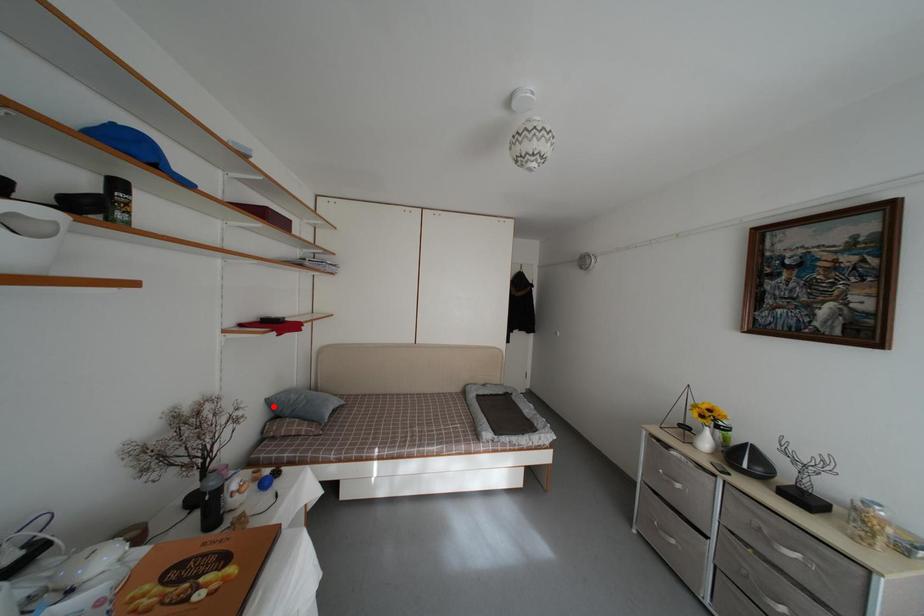
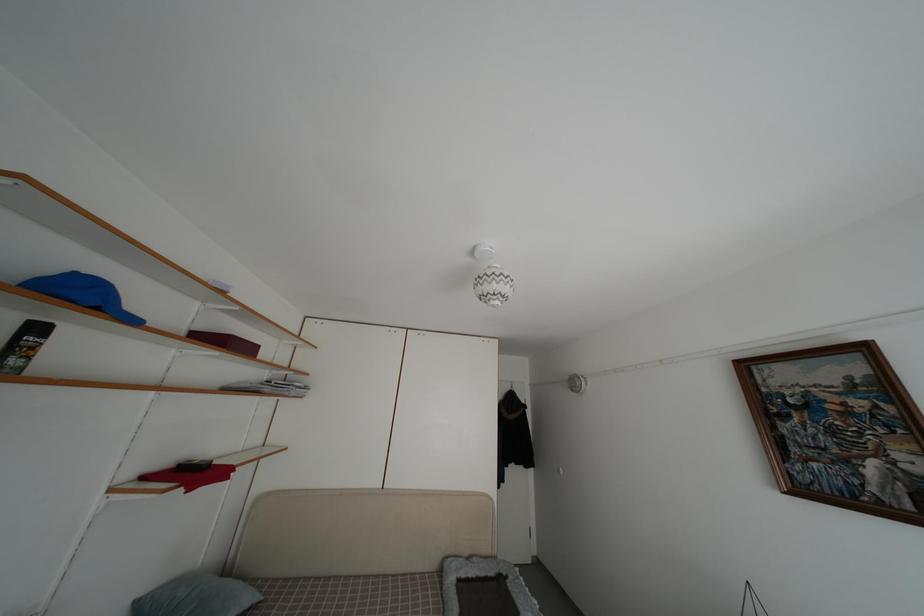
Locate, in the second image, the point that corresponds to the highlighted location in the first image.

(142, 610)